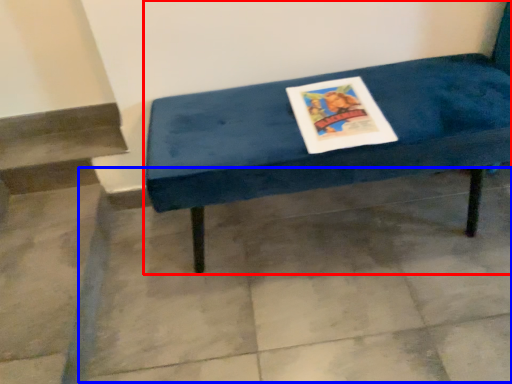
Question: Which object is closer to the camera taking this photo, furniture (highlighted by a red box) or concrete (highlighted by a blue box)?

Choices:
 (A) furniture
 (B) concrete

Answer: (A)